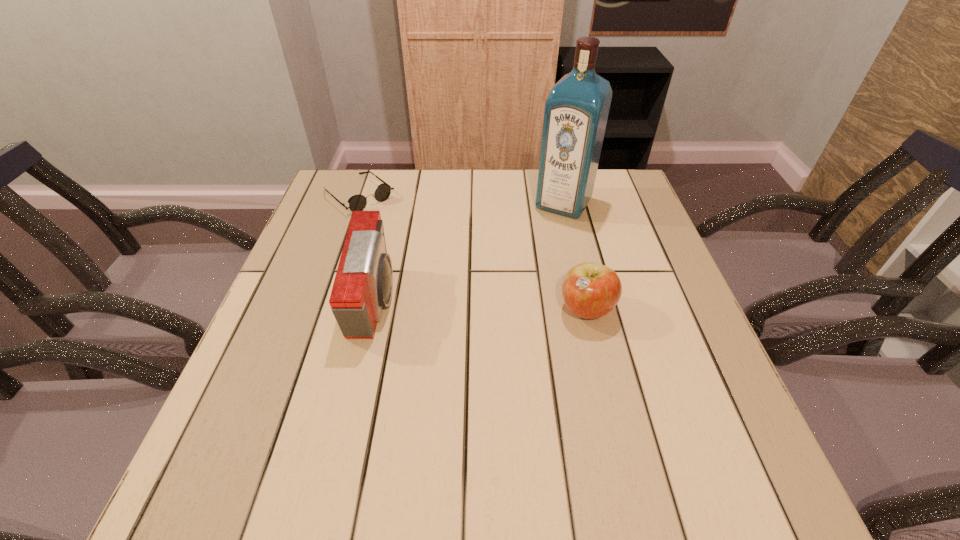
Where is `vacant space situated 0.160m on the front-facing side of the shortest object`? vacant space situated 0.160m on the front-facing side of the shortest object is located at coordinates (412, 238).

You are a GUI agent. You are given a task and a screenshot of the screen. Output one action in this format:
    pyautogui.click(x=<x>, y=<y>)
    Task: Click on the vacant space situated on the front-facing side of the shortest object
    This screenshot has height=540, width=960.
    Given the screenshot: What is the action you would take?
    pyautogui.click(x=396, y=226)

Where is `liquor located at the far edge`? liquor located at the far edge is located at coordinates (576, 111).

At what (x,y) coordinates should I click in order to perform the action: click on sunglasses present at the far edge. Please return your answer as a coordinate pair (x, y). Looking at the image, I should click on (358, 202).

What are the coordinates of `object present at the left edge` in the screenshot? It's located at (358, 202).

The image size is (960, 540). What are the coordinates of `object that is at the right edge` in the screenshot? It's located at (576, 111).

Where is `object positioned at the far left corner`? The height and width of the screenshot is (540, 960). object positioned at the far left corner is located at coordinates (358, 202).

Locate an element on the screen. This screenshot has width=960, height=540. object that is positioned at the far right corner is located at coordinates click(x=576, y=111).

Find the location of a particular element. The image size is (960, 540). free space at the far edge of the desktop is located at coordinates (520, 205).

Identify the location of free region at the near edge of the desktop. (533, 401).